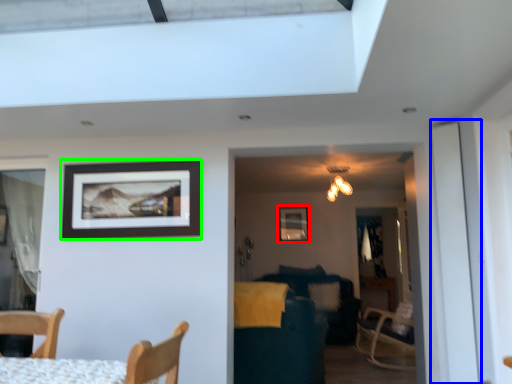
Question: Based on their relative distances, which object is farther from picture frame (highlighted by a red box)? Choose from screen door (highlighted by a blue box) and picture frame (highlighted by a green box).

Choices:
 (A) screen door
 (B) picture frame

Answer: (A)